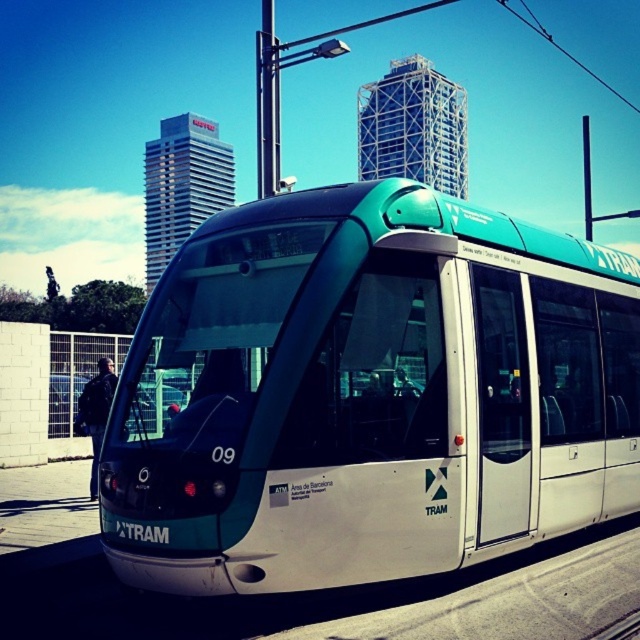
Question: Which object is farther from the camera taking this photo?

Choices:
 (A) black leather jacket at left
 (B) teal glossy tram at center

Answer: (A)

Question: Among these points, which one is farthest from the camera?

Choices:
 (A) (524, 282)
 (B) (100, 369)

Answer: (B)

Question: Does teal glossy tram at center appear on the left side of black leather jacket at left?

Choices:
 (A) no
 (B) yes

Answer: (A)

Question: Does teal glossy tram at center have a lesser width compared to black leather jacket at left?

Choices:
 (A) yes
 (B) no

Answer: (A)

Question: Can you confirm if teal glossy tram at center is positioned below black leather jacket at left?

Choices:
 (A) yes
 (B) no

Answer: (B)

Question: Which of the following is the closest to the observer?

Choices:
 (A) teal glossy tram at center
 (B) black leather jacket at left

Answer: (A)